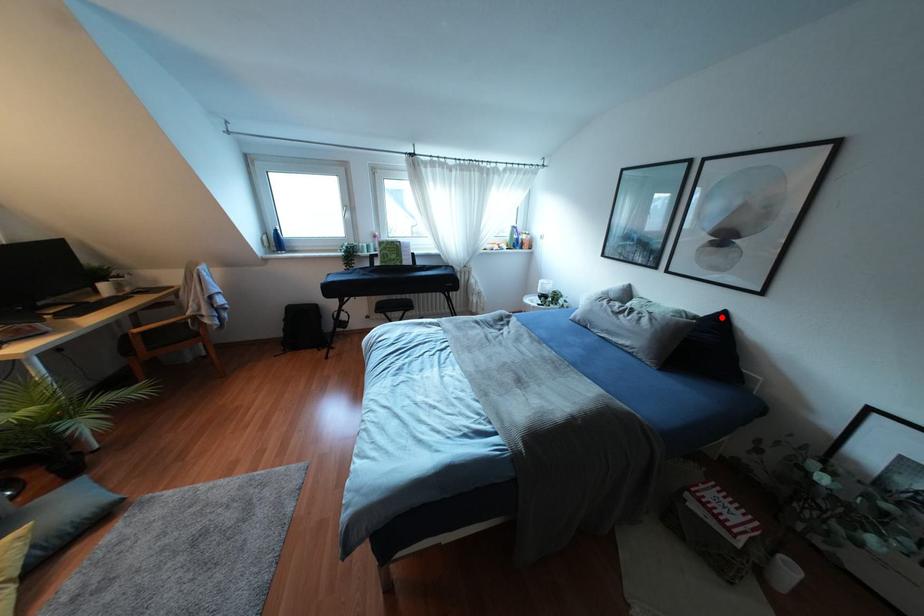
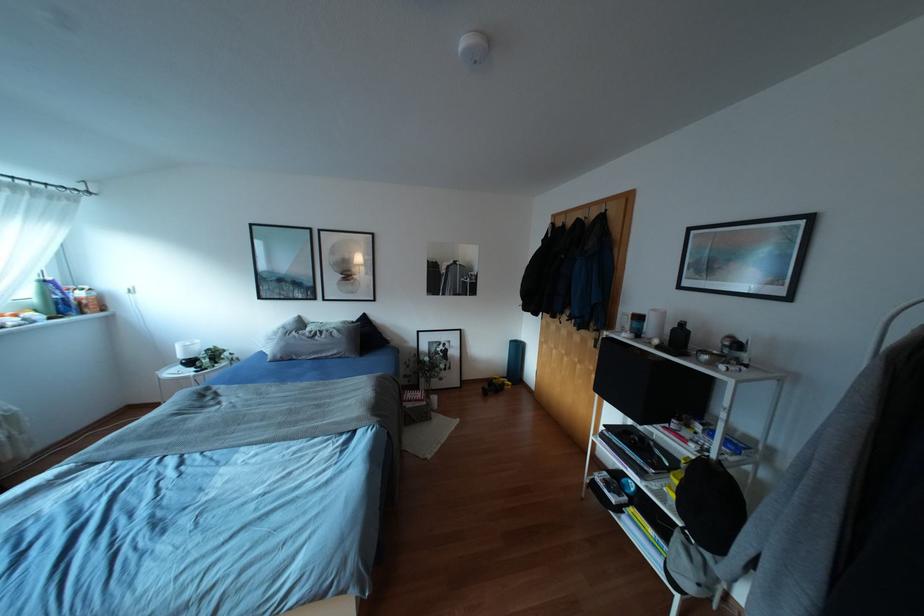
The point at the highlighted location is marked in the first image. Where is the corresponding point in the second image?

(363, 317)